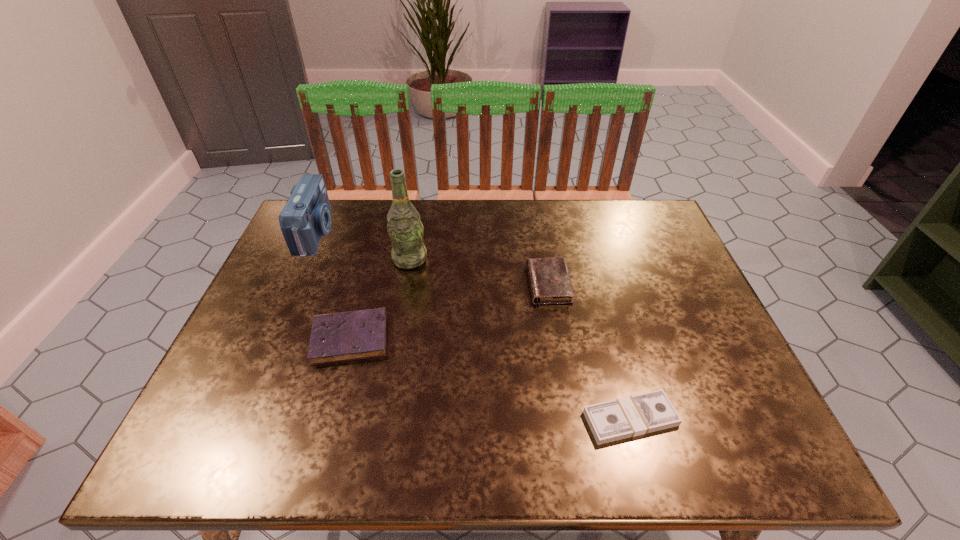
You are a GUI agent. You are given a task and a screenshot of the screen. Output one action in this format:
    pyautogui.click(x=<x>, y=<y>)
    Task: Click on the vacant space at the right edge of the desktop
    The height and width of the screenshot is (540, 960).
    Given the screenshot: What is the action you would take?
    pyautogui.click(x=670, y=318)

Image resolution: width=960 pixels, height=540 pixels. In order to click on vacant space at the far right corner of the desktop in this screenshot , I will do `click(653, 220)`.

In the image, there is a desktop. At what (x,y) coordinates should I click in order to perform the action: click on free region at the near right corner. Please return your answer as a coordinate pair (x, y). Image resolution: width=960 pixels, height=540 pixels. Looking at the image, I should click on (724, 452).

Locate an element on the screen. This screenshot has width=960, height=540. empty space between the camera and the dollar is located at coordinates (473, 326).

Find the location of `free space between the dollar and the right diary`. free space between the dollar and the right diary is located at coordinates (589, 352).

Locate an element on the screen. The height and width of the screenshot is (540, 960). free space between the farther diary and the fourth farthest object is located at coordinates (449, 311).

You are a GUI agent. You are given a task and a screenshot of the screen. Output one action in this format:
    pyautogui.click(x=<x>, y=<y>)
    Task: Click on the free space between the tallest object and the leftmost object
    
    Given the screenshot: What is the action you would take?
    pyautogui.click(x=363, y=246)

Find the location of a particular element. This screenshot has height=540, width=960. vacant space that is in between the nearer diary and the beer bottle is located at coordinates (380, 299).

Find the location of a particular element. This screenshot has height=540, width=960. free space between the dollar and the beer bottle is located at coordinates (520, 339).

Locate an element on the screen. This screenshot has width=960, height=540. free space between the dollar and the right diary is located at coordinates (589, 352).